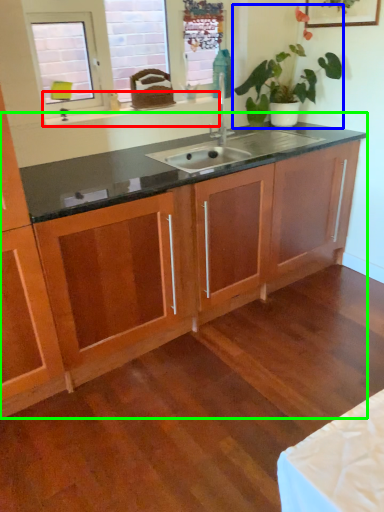
Question: Which is farther away from window sill (highlighted by a red box)? houseplant (highlighted by a blue box) or dresser (highlighted by a green box)?

Choices:
 (A) houseplant
 (B) dresser

Answer: (B)